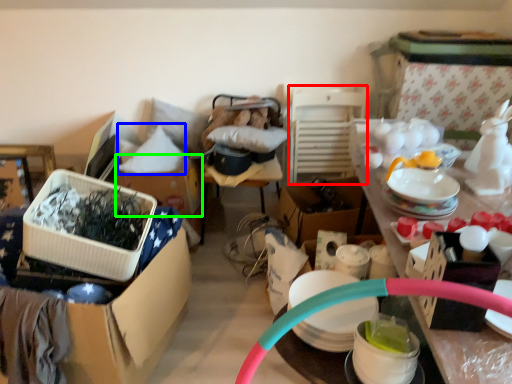
Question: Which object is the closest to the chair (highlighted by a red box)? Choose among these: pillow (highlighted by a blue box) or cardboard box (highlighted by a green box).

Choices:
 (A) pillow
 (B) cardboard box

Answer: (B)